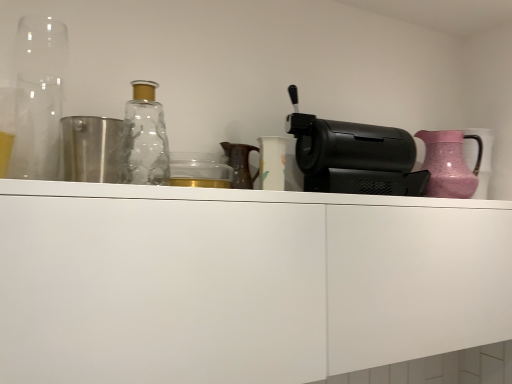
Find the location of a particular element. This screenshot has width=512, height=384. white matte cabinet at center is located at coordinates (241, 282).

Describe the element at coordinates (38, 97) in the screenshot. I see `transparent glass at left` at that location.

Identify the location of pink textured jug at right. Image resolution: width=512 pixels, height=384 pixels. (449, 164).

What are the coordinates of `black plastic coffee machine at right` in the screenshot? It's located at (355, 157).

Based on the photo, is black plastic coffee machine at right taller than transparent glass at left?

No.

Locate an element on the screen. This screenshot has height=384, width=512. glass vase on the left of black plastic coffee machine at right is located at coordinates click(x=38, y=97).

From the image's perspective, is black plastic coffee machine at right below transparent glass at left?

Yes, from the image's perspective, black plastic coffee machine at right is below transparent glass at left.

From a real-world perspective, which is physically below, black plastic coffee machine at right or transparent glass at left?

black plastic coffee machine at right.

Considering the sizes of transparent glass bottle at upper left and white matte cabinet at center in the image, is transparent glass bottle at upper left taller or shorter than white matte cabinet at center?

transparent glass bottle at upper left is shorter than white matte cabinet at center.

Are transparent glass bottle at upper left and white matte cabinet at center far apart?

No, there isn't a large distance between transparent glass bottle at upper left and white matte cabinet at center.

Is transparent glass bottle at upper left located outside white matte cabinet at center?

Yes, transparent glass bottle at upper left is not within white matte cabinet at center.

Considering their positions, is transparent glass bottle at upper left located in front of or behind white matte cabinet at center?

Clearly, transparent glass bottle at upper left is behind white matte cabinet at center.

Is point (151, 158) in front of point (57, 168)?

No, it is behind (57, 168).

Is transparent glass bottle at upper left oriented away from transparent glass at left?

transparent glass bottle at upper left is not turned away from transparent glass at left.

This screenshot has width=512, height=384. There is a transparent glass bottle at upper left. In order to click on glass vase above it (from a real-world perspective) in this screenshot , I will do `click(38, 97)`.

Which object is wider, transparent glass bottle at upper left or transparent glass at left?

Wider between the two is transparent glass at left.

Looking at the image, does transparent glass at left seem bigger or smaller compared to transparent glass bottle at upper left?

transparent glass at left is bigger than transparent glass bottle at upper left.

How different are the orientations of transparent glass at left and transparent glass bottle at upper left in degrees?

0.000984 degrees.

Is transparent glass bottle at upper left completely or partially inside transparent glass at left?

That's incorrect, transparent glass bottle at upper left is not inside transparent glass at left.

Is transparent glass bottle at upper left facing towards pink textured jug at right?

No, transparent glass bottle at upper left does not turn towards pink textured jug at right.

Does point (149, 156) appear closer or farther from the camera than point (481, 152)?

Point (149, 156) is positioned closer to the camera compared to point (481, 152).

Does transparent glass bottle at upper left have a lesser height compared to pink textured jug at right?

No, transparent glass bottle at upper left is not shorter than pink textured jug at right.

From the image's perspective, is pink textured jug at right positioned above or below white matte cabinet at center?

From the image's perspective, pink textured jug at right appears above white matte cabinet at center.

Which of these two, pink textured jug at right or white matte cabinet at center, stands taller?

Standing taller between the two is white matte cabinet at center.

Between pink textured jug at right and white matte cabinet at center, which one has smaller width?

pink textured jug at right.

Is the position of pink textured jug at right more distant than that of white matte cabinet at center?

That is True.

Who is taller, pink textured jug at right or transparent glass bottle at upper left?

transparent glass bottle at upper left is taller.

Which is in front, point (452, 168) or point (143, 140)?

The point (143, 140) is closer to the camera.

Does pink textured jug at right touch transparent glass bottle at upper left?

No, pink textured jug at right is not beside transparent glass bottle at upper left.

Is pink textured jug at right at the left side of transparent glass bottle at upper left?

Incorrect, pink textured jug at right is not on the left side of transparent glass bottle at upper left.

The height and width of the screenshot is (384, 512). What are the coordinates of `coffee machine that is behind the transparent glass at left` in the screenshot? It's located at (355, 157).

The height and width of the screenshot is (384, 512). I want to click on bottle lying on the left of white matte cabinet at center, so click(x=144, y=139).

Consider the image. Looking at the image, which one is located closer to white matte cabinet at center, black plastic coffee machine at right or transparent glass bottle at upper left?

black plastic coffee machine at right.

When comparing their distances from transparent glass bottle at upper left, does white matte cabinet at center or black plastic coffee machine at right seem further?

black plastic coffee machine at right.

When comparing their distances from pink textured jug at right, does white matte cabinet at center or black plastic coffee machine at right seem further?

The object further to pink textured jug at right is white matte cabinet at center.

From the image, which object appears to be farther from black plastic coffee machine at right, transparent glass bottle at upper left or white matte cabinet at center?

Among the two, transparent glass bottle at upper left is located further to black plastic coffee machine at right.

Which object lies nearer to the anchor point transparent glass at left, black plastic coffee machine at right or transparent glass bottle at upper left?

transparent glass bottle at upper left lies closer to transparent glass at left than the other object.

Considering their positions, is transparent glass at left positioned closer to transparent glass bottle at upper left than white matte cabinet at center?

Based on the image, transparent glass at left appears to be nearer to transparent glass bottle at upper left.

Estimate the real-world distances between objects in this image. Which object is further from transparent glass bottle at upper left, black plastic coffee machine at right or transparent glass at left?

black plastic coffee machine at right is further to transparent glass bottle at upper left.

When comparing their distances from white matte cabinet at center, does pink textured jug at right or transparent glass bottle at upper left seem closer?

Based on the image, transparent glass bottle at upper left appears to be nearer to white matte cabinet at center.

Image resolution: width=512 pixels, height=384 pixels. Identify the location of coffee machine situated between transparent glass at left and pink textured jug at right from left to right. (355, 157).

At what (x,y) coordinates should I click in order to perform the action: click on bottle between transparent glass at left and black plastic coffee machine at right in the horizontal direction. Please return your answer as a coordinate pair (x, y). The image size is (512, 384). Looking at the image, I should click on click(144, 139).

This screenshot has width=512, height=384. What are the coordinates of `cabinetry located between transparent glass bottle at upper left and black plastic coffee machine at right in the left-right direction` in the screenshot? It's located at (241, 282).

Locate an element on the screen. This screenshot has width=512, height=384. coffee machine between transparent glass bottle at upper left and pink textured jug at right from left to right is located at coordinates (355, 157).